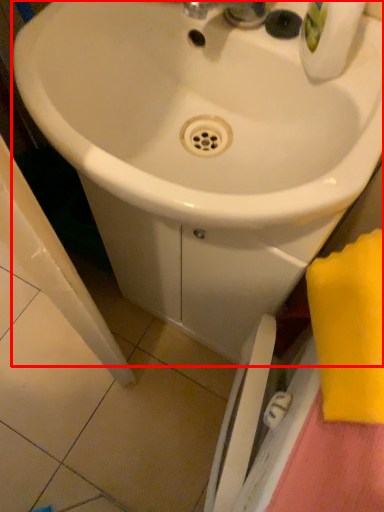
Question: In this image, where is sink (annotated by the red box) located relative to beach towel?

Choices:
 (A) right
 (B) left

Answer: (B)